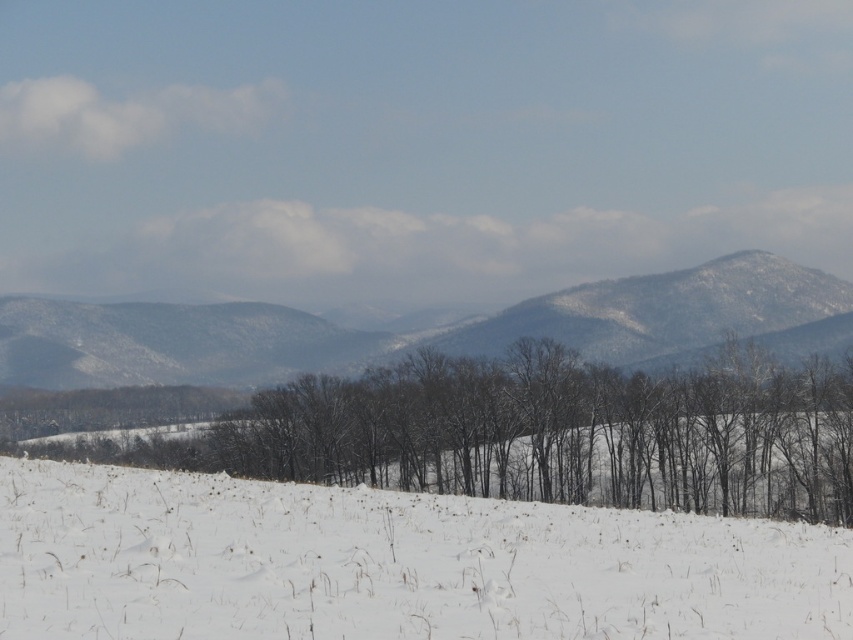
Is snowy bare trees at lower center below snowy textured mountain at center?

Yes.

Can you confirm if snowy bare trees at lower center is bigger than snowy textured mountain at center?

Incorrect, snowy bare trees at lower center is not larger than snowy textured mountain at center.

Between point (219, 449) and point (244, 324), which one is positioned in front?

Point (219, 449) is more forward.

You are a GUI agent. You are given a task and a screenshot of the screen. Output one action in this format:
    pyautogui.click(x=<x>, y=<y>)
    Task: Click on the snowy bare trees at lower center
    The width and height of the screenshot is (853, 640).
    Given the screenshot: What is the action you would take?
    pyautogui.click(x=544, y=433)

Which is more to the right, white snow at center or snowy textured mountain at center?

From the viewer's perspective, white snow at center appears more on the right side.

Between white snow at center and snowy textured mountain at center, which one is positioned lower?

white snow at center

Measure the distance between white snow at center and camera.

white snow at center is 7.08 meters from camera.

At what (x,y) coordinates should I click in order to perform the action: click on white snow at center. Please return your answer as a coordinate pair (x, y). The image size is (853, 640). Looking at the image, I should click on (392, 564).

Between white snow at center and snowy bare trees at lower center, which one has less height?

white snow at center

Is white snow at center to the left of snowy bare trees at lower center from the viewer's perspective?

Incorrect, white snow at center is not on the left side of snowy bare trees at lower center.

Who is more forward, (x=544, y=532) or (x=146, y=401)?

Positioned in front is point (x=544, y=532).

The image size is (853, 640). I want to click on white snow at center, so click(x=392, y=564).